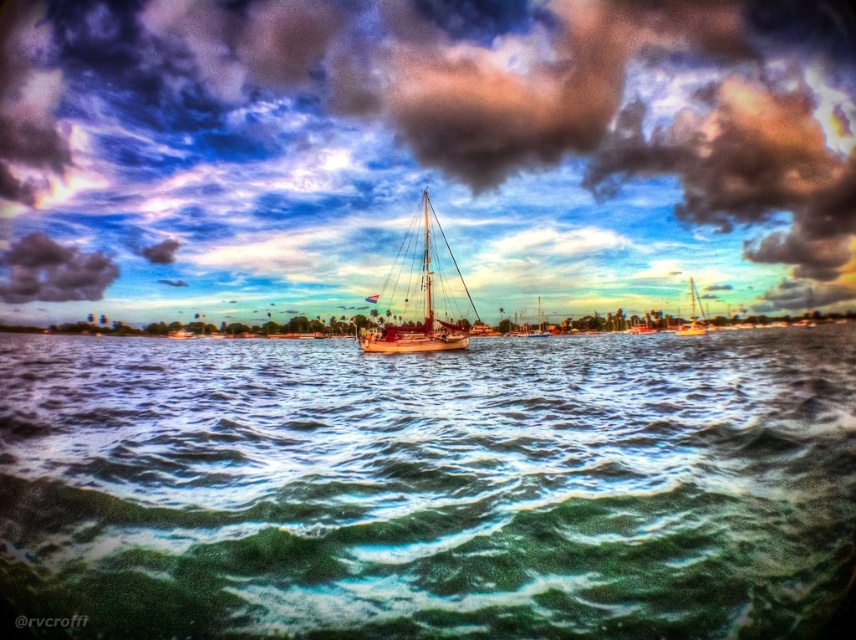
Based on the photo, you are a sailor on the wooden sailboat at center. Looking up, you notice the dark gray cloud at upper center. Is the cloud above or below the boat?

The dark gray cloud at upper center is located above the wooden sailboat at center, so the cloud is above the boat.

You are a seagull flying above the seascape. You see the green wavy water at center and the dark gray cloud at upper center. Which object is closer to the ground?

The green wavy water at center is closer to the ground because it is not as tall as the dark gray cloud at upper center.